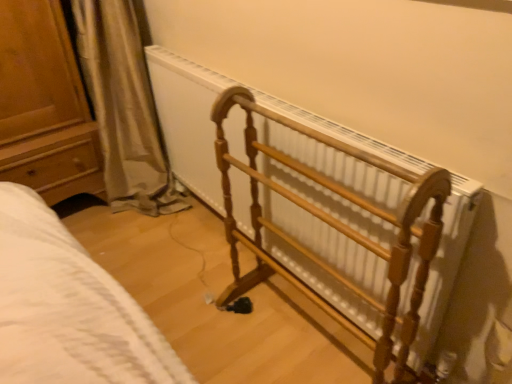
What do you see at coordinates (335, 229) in the screenshot? The width and height of the screenshot is (512, 384). I see `wooden rack at center` at bounding box center [335, 229].

Locate an element on the screen. This screenshot has height=384, width=512. wooden rack at center is located at coordinates (335, 229).

Where is `wooden rack at center`? The width and height of the screenshot is (512, 384). wooden rack at center is located at coordinates (335, 229).